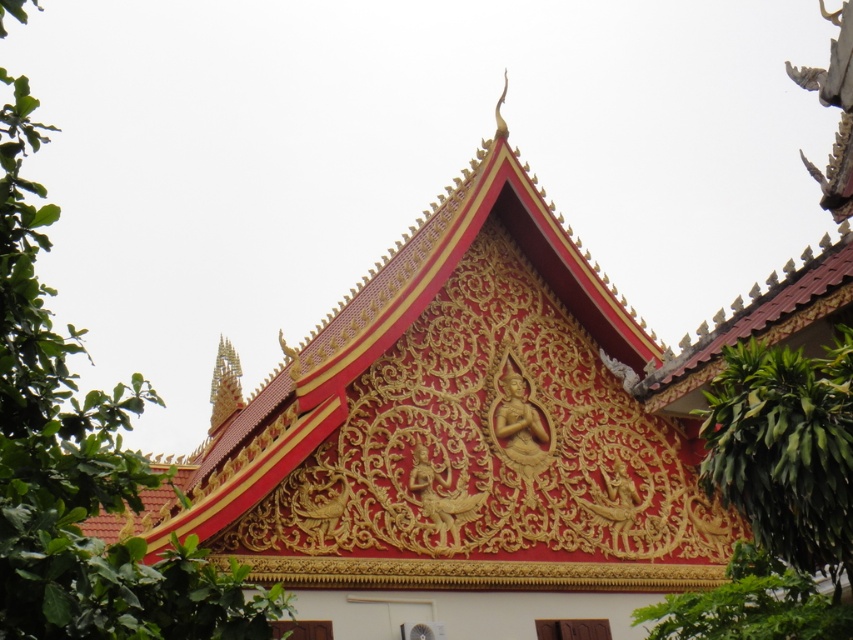
You are an architect analyzing the symmetry of the temple structure. Given that both the green leafy tree at left and the green leafy tree at right flank the temple, which one is taller?

The green leafy tree at left is taller than the green leafy tree at right.

You are standing in front of the temple and want to take a photo that includes both the temple and the green leafy tree at left. Where should you position yourself to ensure both are in the frame?

Position yourself to the right side of the temple so that the green leafy tree at left is visible in the left portion of the frame while the temple occupies the central or right area.